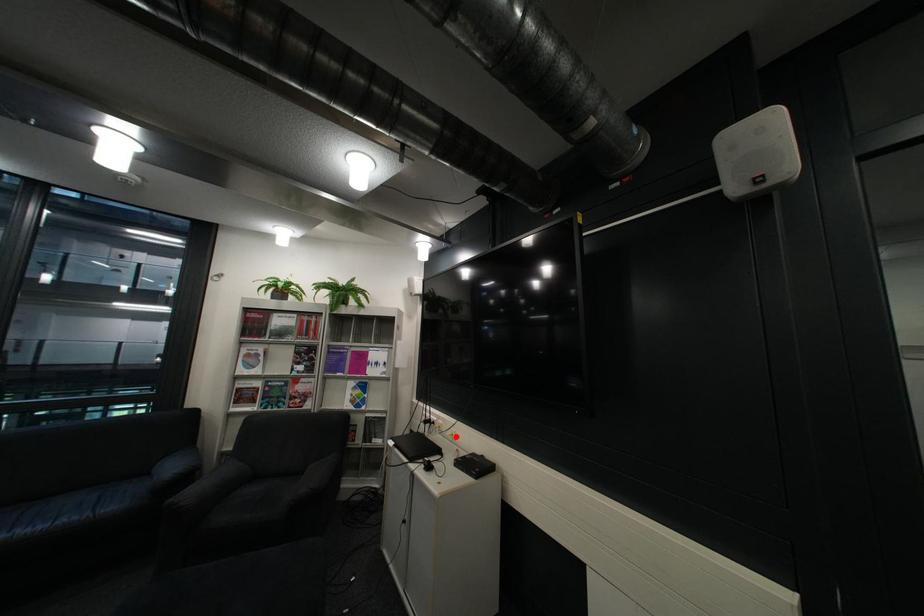
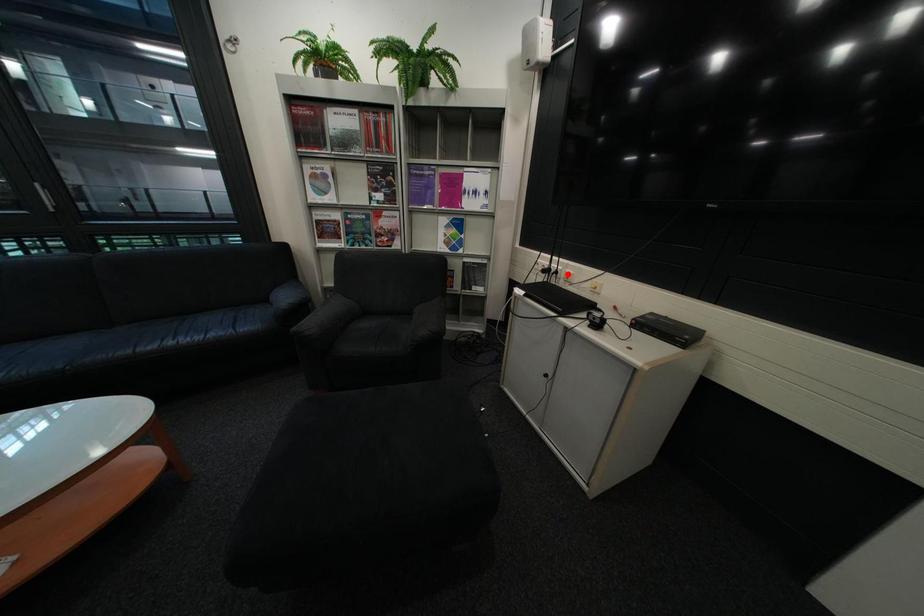
I am providing you with two images of the same scene from different viewpoints. A red point is marked on the first image and another point is marked on the second image. Does the point marked in image1 correspond to the same location as the one in image2?

No